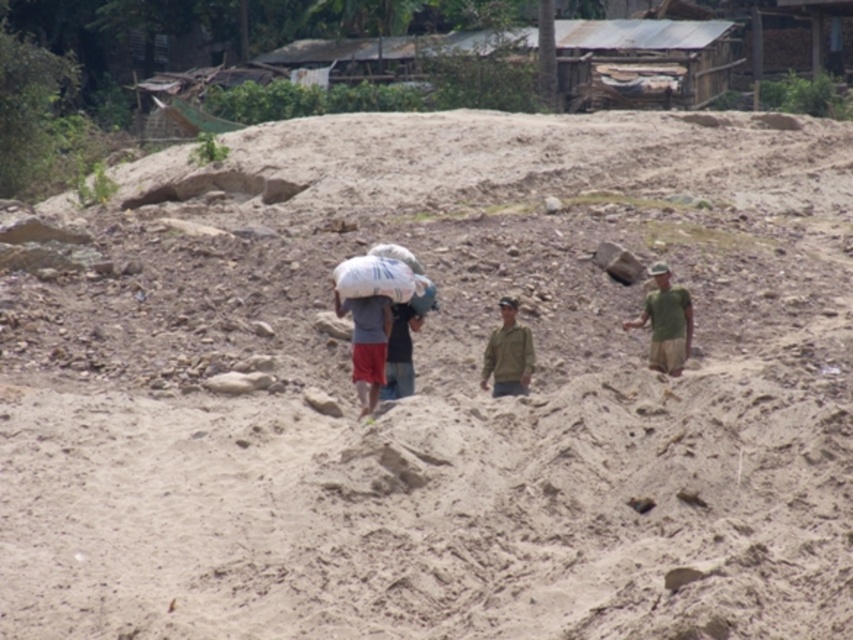
You are a photographer trying to capture a closeup of the green matte hat at center and the green fabric cap at center. Which one is located higher on the person?

The green matte hat at center is positioned over the green fabric cap at center, so the green matte hat at center is higher.